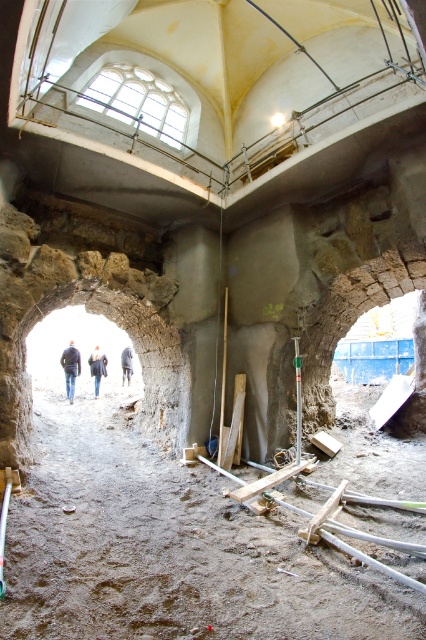
Question: Does rough stone tunnel at center appear on the right side of dark blue jeans at center?

Choices:
 (A) no
 (B) yes

Answer: (B)

Question: Can you confirm if rough stone tunnel at center is positioned below blue denim jacket at center?

Choices:
 (A) no
 (B) yes

Answer: (A)

Question: Which object appears closest to the camera in this image?

Choices:
 (A) dark blue jeans at center
 (B) dirt ground at center
 (C) blue denim jacket at center
 (D) dark gray fabric construction worker at center

Answer: (B)

Question: Observing the image, what is the correct spatial positioning of dirt ground at center in reference to blue denim jacket at center?

Choices:
 (A) right
 (B) left

Answer: (A)

Question: Which point is farther from the camera taking this photo?

Choices:
 (A) (98, 381)
 (B) (146, 404)
 (C) (127, 385)

Answer: (C)

Question: Which point is farther to the camera?

Choices:
 (A) (68, 349)
 (B) (65, 616)

Answer: (A)